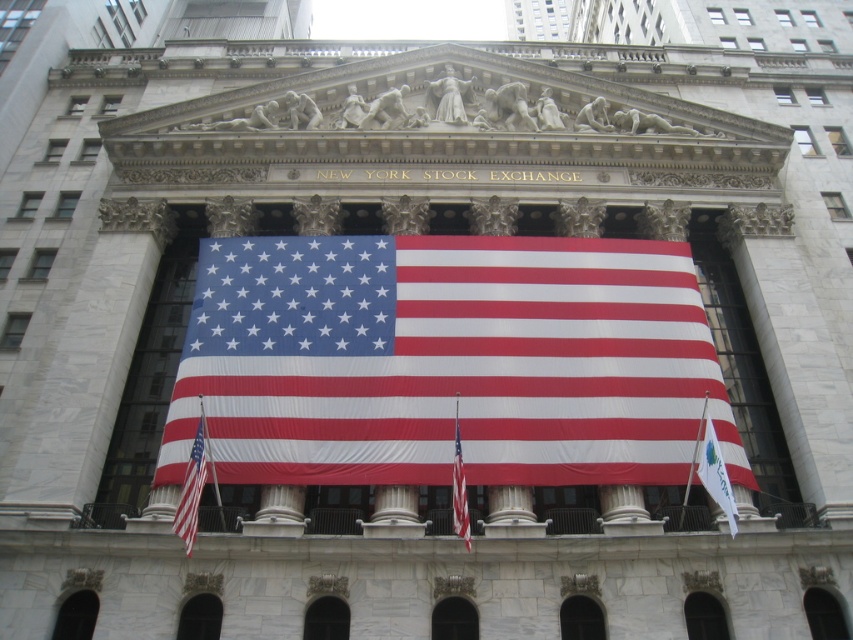
Question: Which object is the closest to the white fabric flag at right?

Choices:
 (A) red fabric flag at center
 (B) red-white striped fabric flag at center
 (C) polyester american flag at center

Answer: (A)

Question: Which object appears farthest from the camera in this image?

Choices:
 (A) red fabric flag at center
 (B) red-white striped fabric flag at center
 (C) polyester american flag at center
 (D) white fabric flag at right

Answer: (C)

Question: Is red-white striped fabric flag at center below red fabric flag at center?

Choices:
 (A) no
 (B) yes

Answer: (A)

Question: Can you confirm if polyester american flag at center is positioned to the left of white fabric flag at right?

Choices:
 (A) no
 (B) yes

Answer: (B)

Question: Which object appears farthest from the camera in this image?

Choices:
 (A) red fabric flag at center
 (B) polyester american flag at center

Answer: (B)

Question: Does white fabric flag at right appear under red fabric flag at center?

Choices:
 (A) no
 (B) yes

Answer: (A)